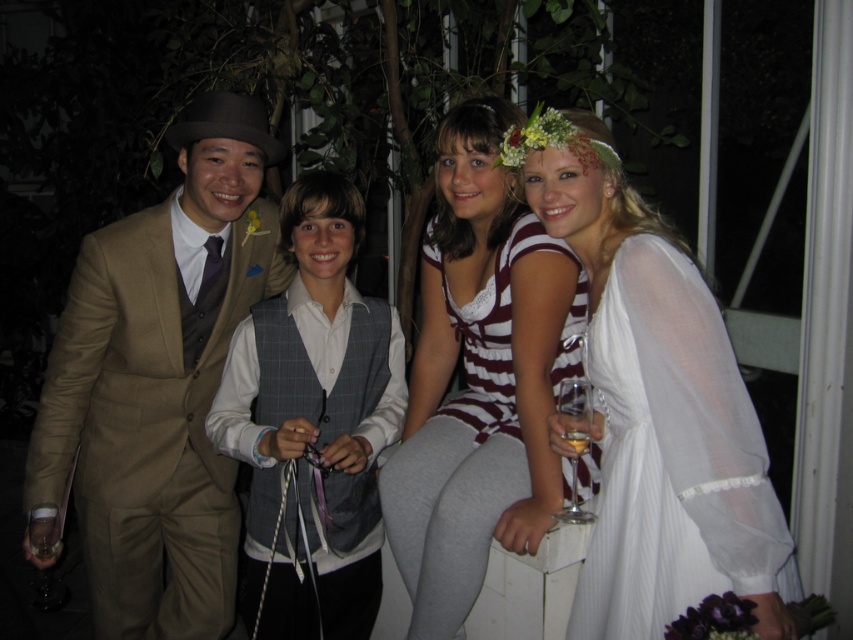
Does matte brown suit at left have a lesser height compared to clear glass wine glass at lower right?

No.

This screenshot has width=853, height=640. Identify the location of matte brown suit at left. (x=160, y=381).

Between point (171, 428) and point (578, 419), which one is positioned behind?

The point (171, 428) is more distant.

You are a GUI agent. You are given a task and a screenshot of the screen. Output one action in this format:
    pyautogui.click(x=<x>, y=<y>)
    Task: Click on the matte brown suit at left
    The width and height of the screenshot is (853, 640).
    Given the screenshot: What is the action you would take?
    pyautogui.click(x=160, y=381)

From the picture: Is matte brown suit at left taller than white sheer dress at center?

Yes, matte brown suit at left is taller than white sheer dress at center.

Does matte brown suit at left have a lesser height compared to white sheer dress at center?

Incorrect, matte brown suit at left's height does not fall short of white sheer dress at center's.

Find the location of a particular element. This screenshot has height=640, width=853. matte brown suit at left is located at coordinates (160, 381).

Find the location of a particular element. Image resolution: width=853 pixels, height=640 pixels. matte brown suit at left is located at coordinates (160, 381).

Is matte brown suit at left thinner than white sheer dress at right?

No, matte brown suit at left is not thinner than white sheer dress at right.

Which is below, matte brown suit at left or white sheer dress at right?

matte brown suit at left

Where is `matte brown suit at left`? This screenshot has height=640, width=853. matte brown suit at left is located at coordinates (160, 381).

At what (x,y) coordinates should I click in order to perform the action: click on matte brown suit at left. Please return your answer as a coordinate pair (x, y). This screenshot has height=640, width=853. Looking at the image, I should click on (160, 381).